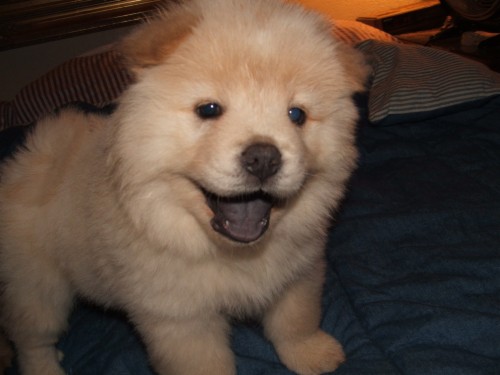
Identify the location of blanket. This screenshot has width=500, height=375. (414, 241).